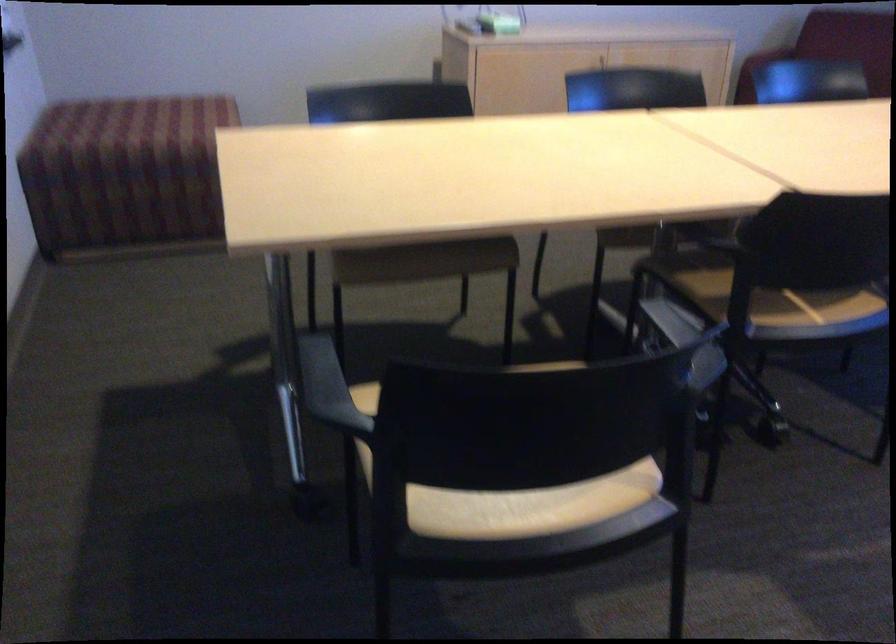
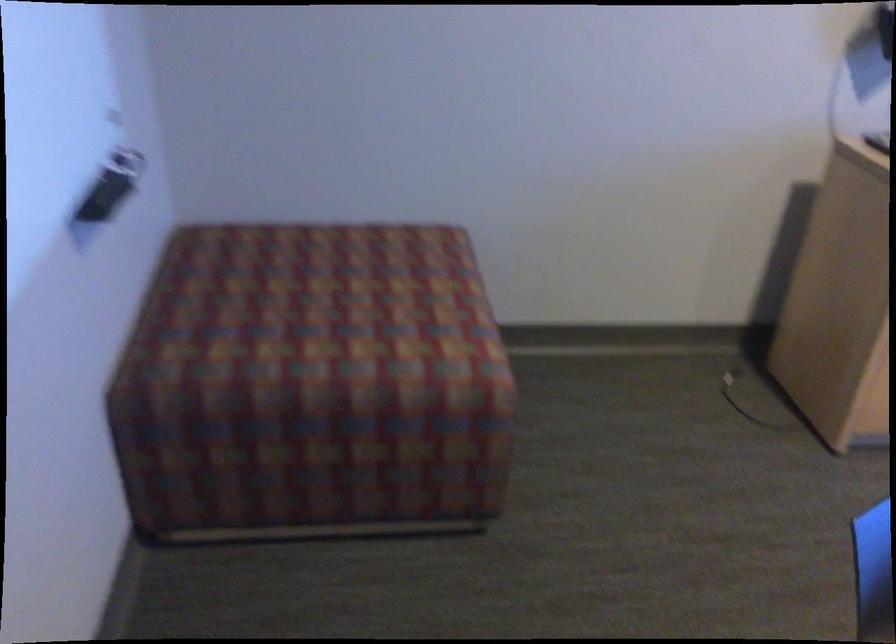
What movement of the cameraman would produce the second image?

The movement direction of the cameraman is left, forward.